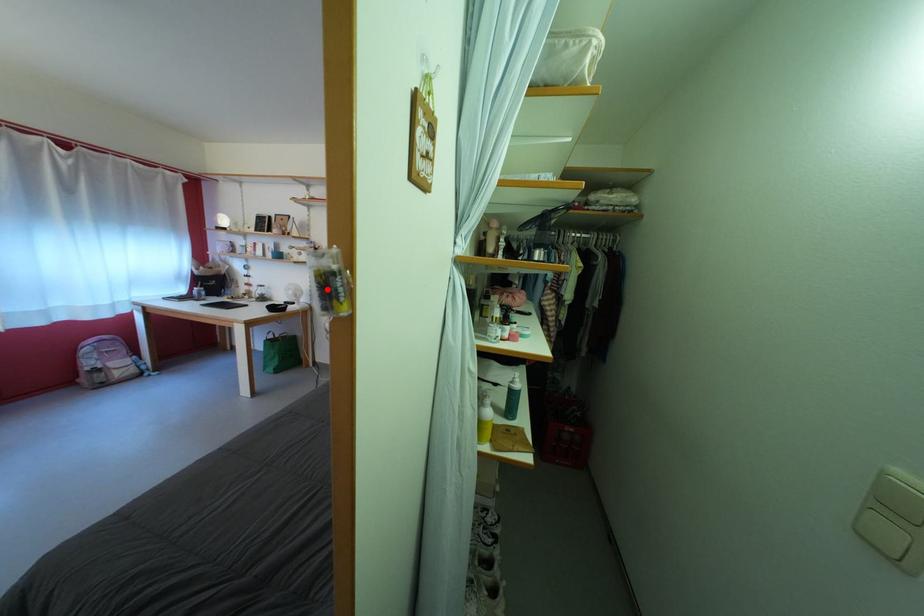
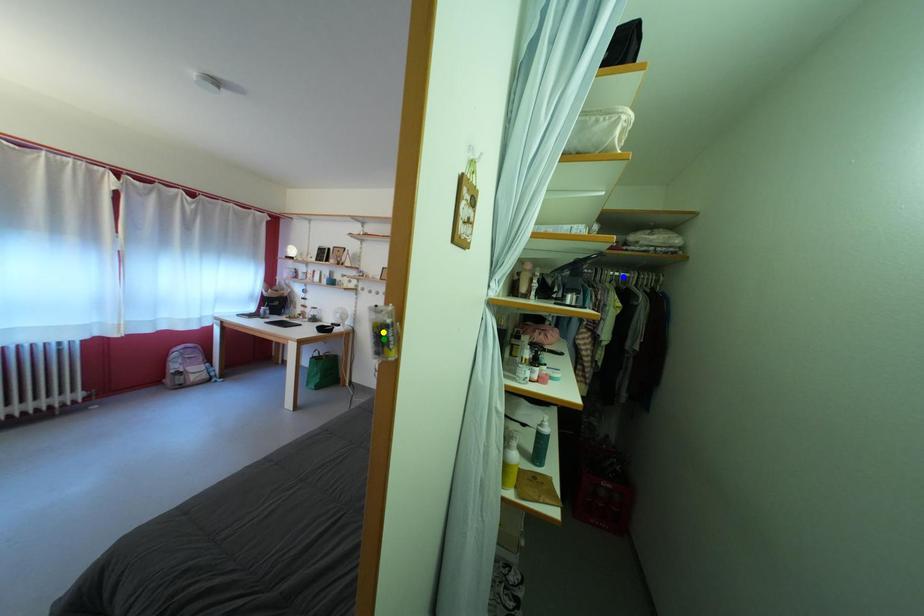
Question: I am providing you with two images of the same scene from different viewpoints. A red point is marked on the first image. You are given multiple points on the second image. Which spot in image 2 lines up with the point in image 1?

Choices:
 (A) green point
 (B) blue point
 (C) yellow point

Answer: (A)